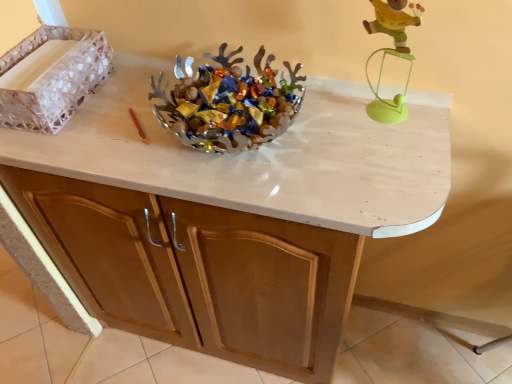
In order to click on free space in front of white textured tray at left in this screenshot , I will do `click(64, 145)`.